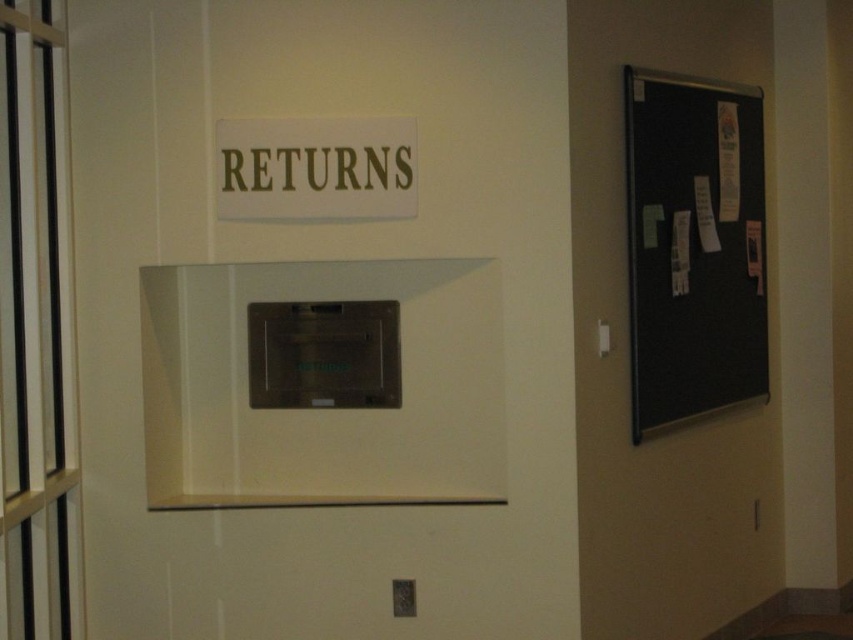
Question: Can you confirm if black feltboard at right is wider than brown metallic returns at upper center?

Choices:
 (A) yes
 (B) no

Answer: (A)

Question: Can you confirm if gold metallic sign at upper center is positioned below satin black oven at center?

Choices:
 (A) yes
 (B) no

Answer: (B)

Question: Which of the following is the farthest from the observer?

Choices:
 (A) (718, 92)
 (B) (349, 160)
 (C) (322, 358)

Answer: (A)

Question: Among these points, which one is farthest from the camera?

Choices:
 (A) (360, 369)
 (B) (410, 166)
 (C) (691, 186)

Answer: (C)

Question: Among these objects, which one is nearest to the camera?

Choices:
 (A) gold metallic sign at upper center
 (B) black feltboard at right
 (C) brown metallic returns at upper center

Answer: (A)

Question: Is satin black oven at center to the left of brown metallic returns at upper center from the viewer's perspective?

Choices:
 (A) yes
 (B) no

Answer: (B)